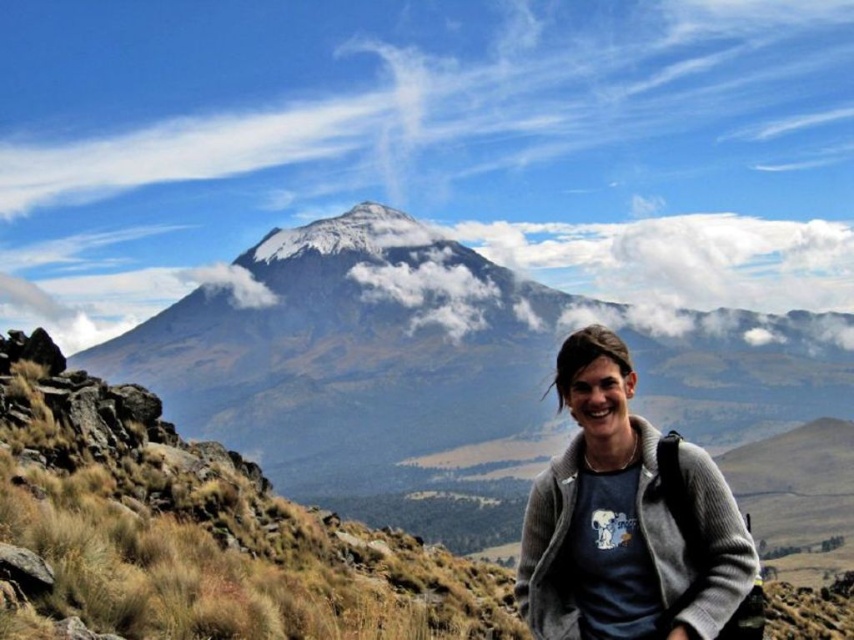
Question: Is snowy rock mountain at center above gray woolen sweater at center?

Choices:
 (A) no
 (B) yes

Answer: (A)

Question: Which point is closer to the camera?

Choices:
 (A) gray woolen sweater at center
 (B) snowy rock mountain at center

Answer: (A)

Question: Which point is farther to the camera?

Choices:
 (A) gray woolen sweater at center
 (B) snowy rock mountain at center

Answer: (B)

Question: Can you confirm if snowy rock mountain at center is positioned to the right of gray woolen sweater at center?

Choices:
 (A) no
 (B) yes

Answer: (B)

Question: Can you confirm if snowy rock mountain at center is positioned to the left of gray woolen sweater at center?

Choices:
 (A) yes
 (B) no

Answer: (B)